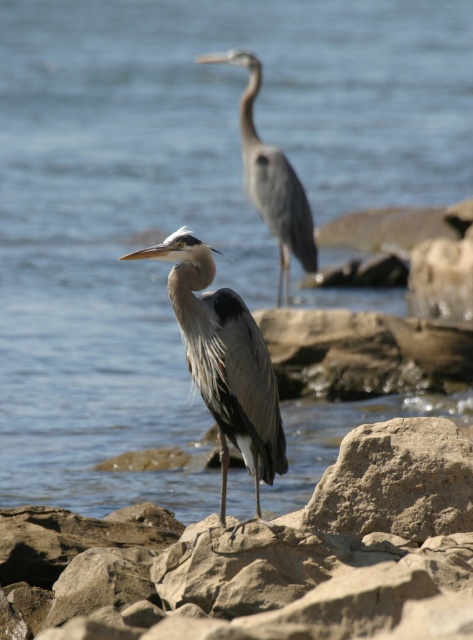
You are standing at the point marked as point [175,310]. The heron in the foreground is 1.2 meters tall. Can you see the top of the heron without moving your head?

The point [175,310] is 4.79 meters away from the viewer. Since the heron is only 1.2 meters tall, you would need to tilt your head slightly downward to see the top of the heron from that distance.

You are a photographer aiming to capture a closeup of the smooth gray rock at center and the rough textured rock at center. Since you want both rocks to be clearly visible in your photo, which rock should you focus on to ensure both are in focus?

The smooth gray rock at center is larger in size than rough textured rock at center, so focusing on the larger smooth gray rock at center will help ensure both rocks are in focus as it occupies more of the frame.

You are a wildlife photographer aiming to capture a clear shot of the gray matte heron at center. Based on the scene description, where should you position your camera to ensure the heron is in focus?

The gray matte heron at center is located at point [225,360], so you should position your camera to focus at that coordinate to ensure the heron is in focus.